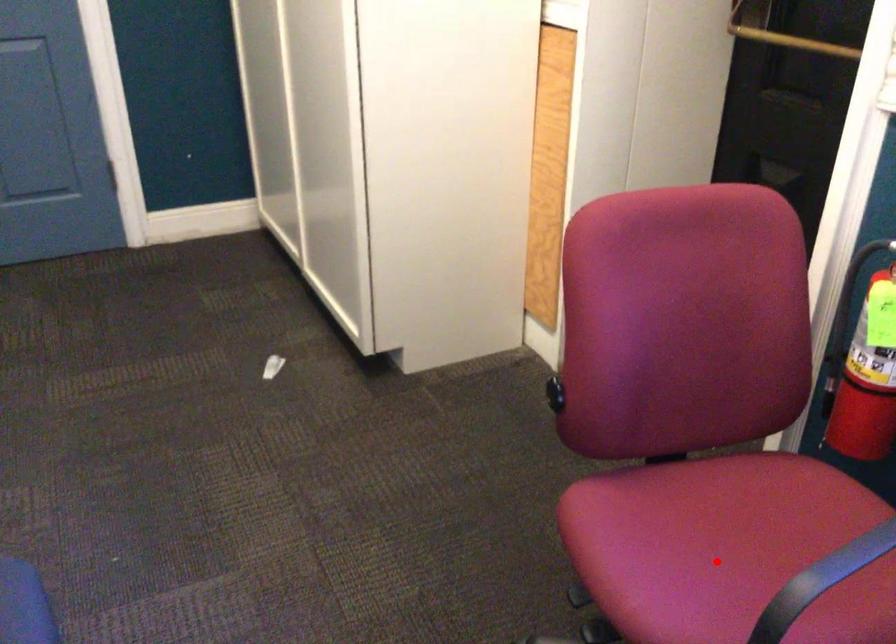
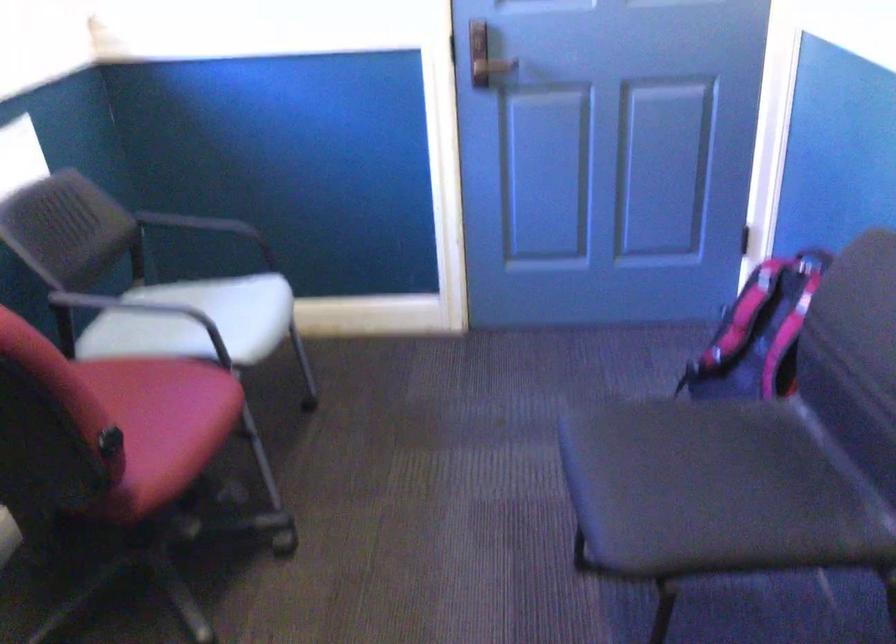
Question: I am providing you with two images of the same scene from different viewpoints. In image1, a red point is highlighted. Considering the same 3D point in image2, which of the following is correct?

Choices:
 (A) It is closer
 (B) It is farther

Answer: (B)